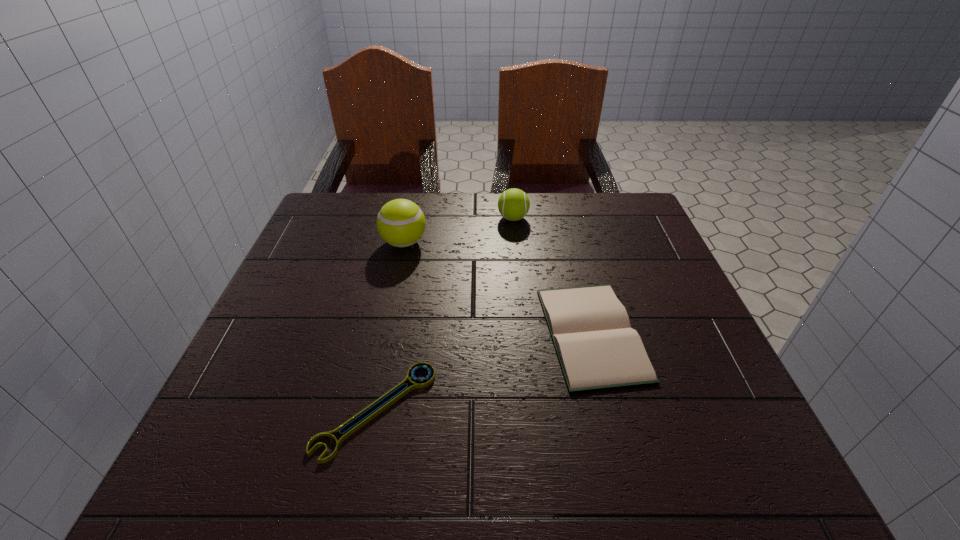
You are a GUI agent. You are given a task and a screenshot of the screen. Output one action in this format:
    pyautogui.click(x=<x>, y=<y>)
    Task: Click on the vacant space that's between the nearer tennis ball and the right tennis ball
    
    Given the screenshot: What is the action you would take?
    pyautogui.click(x=459, y=231)

Where is `vacant space that's between the second tallest object and the hardback book`? Image resolution: width=960 pixels, height=540 pixels. vacant space that's between the second tallest object and the hardback book is located at coordinates (552, 276).

Locate an element on the screen. free space between the wrench and the taller tennis ball is located at coordinates (390, 326).

Find the location of a particular element. This screenshot has height=540, width=960. unoccupied position between the right tennis ball and the second shortest object is located at coordinates (552, 276).

The width and height of the screenshot is (960, 540). Find the location of `unoccupied position between the nearer tennis ball and the shorter tennis ball`. unoccupied position between the nearer tennis ball and the shorter tennis ball is located at coordinates (459, 231).

Identify the location of free area in between the wrench and the third tallest object. This screenshot has height=540, width=960. (484, 372).

The height and width of the screenshot is (540, 960). In order to click on free space between the shortest object and the hardback book in this screenshot , I will do `click(484, 372)`.

Find the location of a particular element. The width and height of the screenshot is (960, 540). vacant area that lies between the taller tennis ball and the shortest object is located at coordinates (390, 326).

The height and width of the screenshot is (540, 960). Find the location of `object that stands as the closest to the wrench`. object that stands as the closest to the wrench is located at coordinates (597, 348).

This screenshot has width=960, height=540. What are the coordinates of `object that is the nearest to the third shortest object` in the screenshot? It's located at (401, 223).